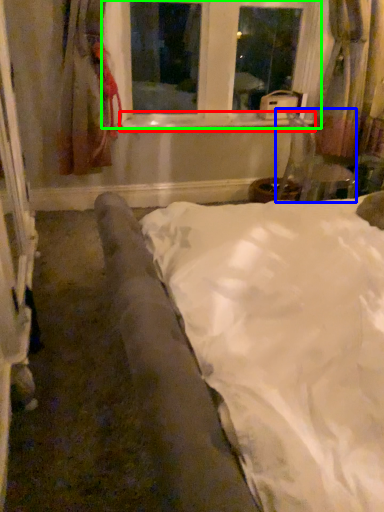
Question: Estimate the real-world distances between objects in this image. Which object is closer to window sill (highlighted by a red box), armchair (highlighted by a blue box) or window (highlighted by a green box)?

Choices:
 (A) armchair
 (B) window

Answer: (B)